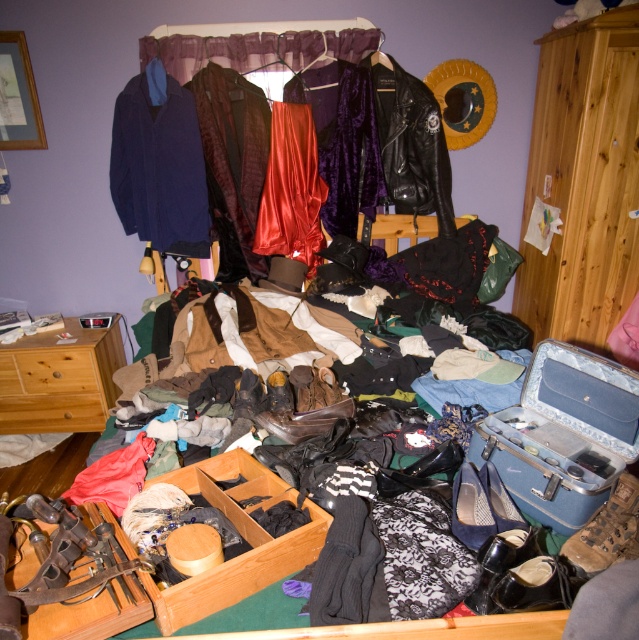
Does velvet jacket at center appear on the right side of black leather jacket at center?

Incorrect, velvet jacket at center is not on the right side of black leather jacket at center.

The width and height of the screenshot is (639, 640). In order to click on velvet jacket at center in this screenshot , I will do `click(233, 163)`.

How distant is navy wool coat at upper left from black leather jacket at center?

navy wool coat at upper left is 36.03 inches away from black leather jacket at center.

Image resolution: width=639 pixels, height=640 pixels. Identify the location of navy wool coat at upper left. (158, 164).

Can you confirm if navy wool coat at upper left is positioned below brown wood dresser at lower left?

No.

Can you confirm if navy wool coat at upper left is taller than brown wood dresser at lower left?

Indeed, navy wool coat at upper left has a greater height compared to brown wood dresser at lower left.

What do you see at coordinates (158, 164) in the screenshot?
I see `navy wool coat at upper left` at bounding box center [158, 164].

Where is `navy wool coat at upper left`? The height and width of the screenshot is (640, 639). navy wool coat at upper left is located at coordinates (158, 164).